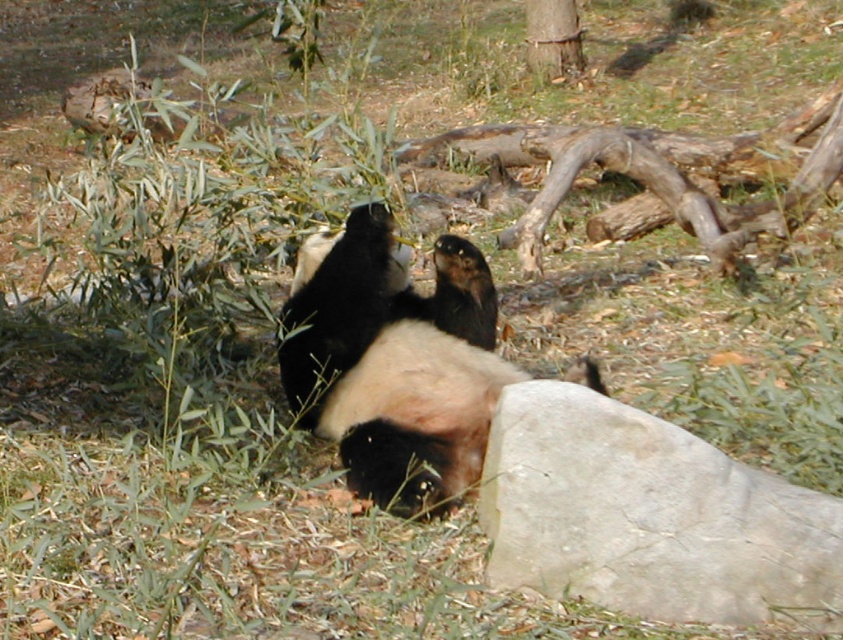
Is gray rough rock at lower right closer to the viewer compared to black fur panda at center?

That is True.

Is gray rough rock at lower right shorter than black fur panda at center?

Yes, gray rough rock at lower right is shorter than black fur panda at center.

Is point (533, 445) closer to viewer compared to point (301, 336)?

Yes.

Locate an element on the screen. gray rough rock at lower right is located at coordinates (648, 516).

Based on the photo, does gray rough rock at lower right have a greater height compared to smooth brown tree trunk at upper center?

In fact, gray rough rock at lower right may be shorter than smooth brown tree trunk at upper center.

Who is more distant from viewer, (691,449) or (562,22)?

Positioned behind is point (562,22).

What do you see at coordinates (648, 516) in the screenshot? The height and width of the screenshot is (640, 843). I see `gray rough rock at lower right` at bounding box center [648, 516].

Identify the location of gray rough rock at lower right. Image resolution: width=843 pixels, height=640 pixels. (648, 516).

Can you confirm if black fur panda at center is positioned to the right of smooth brown tree trunk at upper center?

No, black fur panda at center is not to the right of smooth brown tree trunk at upper center.

Does black fur panda at center appear on the left side of smooth brown tree trunk at upper center?

Indeed, black fur panda at center is positioned on the left side of smooth brown tree trunk at upper center.

Does point (411, 452) come closer to viewer compared to point (560, 26)?

Yes, it is in front of point (560, 26).

I want to click on black fur panda at center, so click(x=395, y=362).